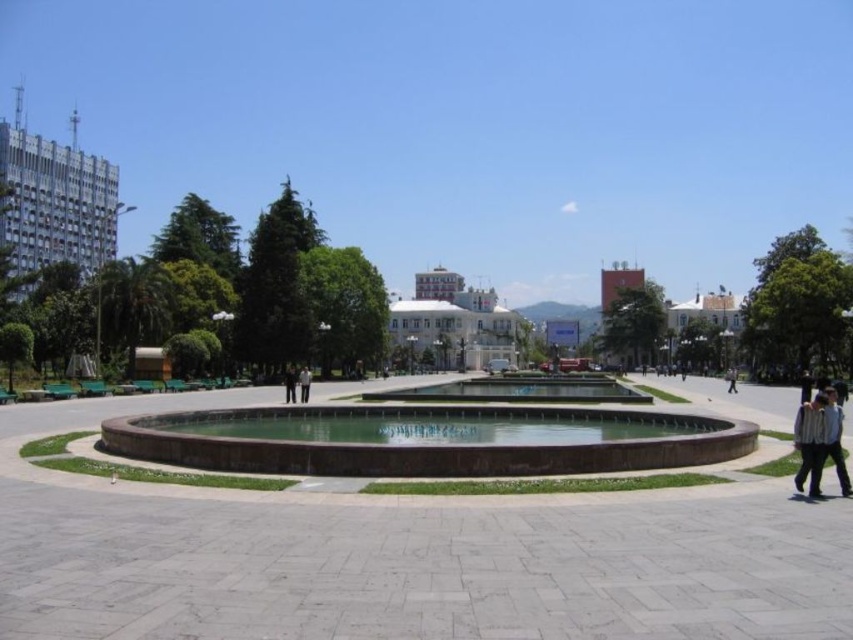
Question: Which object appears closest to the camera in this image?

Choices:
 (A) white striped shirt at lower right
 (B) dark gray suit at center
 (C) black leather pants at center
 (D) brown stone fountain at center

Answer: (A)

Question: Which object is positioned farthest from the black leather pants at center?

Choices:
 (A) light blue shirt at right
 (B) brown stone fountain at center
 (C) dark gray suit at center
 (D) light gray fabric jacket at lower right

Answer: (D)

Question: Is light blue shirt at right bigger than black leather pants at center?

Choices:
 (A) no
 (B) yes

Answer: (A)

Question: Is light blue shirt at right in front of black leather pants at center?

Choices:
 (A) yes
 (B) no

Answer: (A)

Question: Does light blue shirt at right appear on the right side of light gray fabric jacket at lower right?

Choices:
 (A) no
 (B) yes

Answer: (A)

Question: Which object is closer to the camera taking this photo?

Choices:
 (A) brown stone fountain at center
 (B) light gray fabric jacket at lower right

Answer: (A)